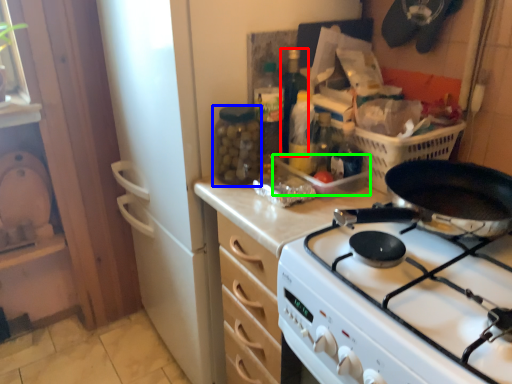
Question: Based on their relative distances, which object is farther from bottle (highlighted by a red box)? Choose from bottle (highlighted by a blue box) and appliance (highlighted by a green box).

Choices:
 (A) bottle
 (B) appliance

Answer: (B)